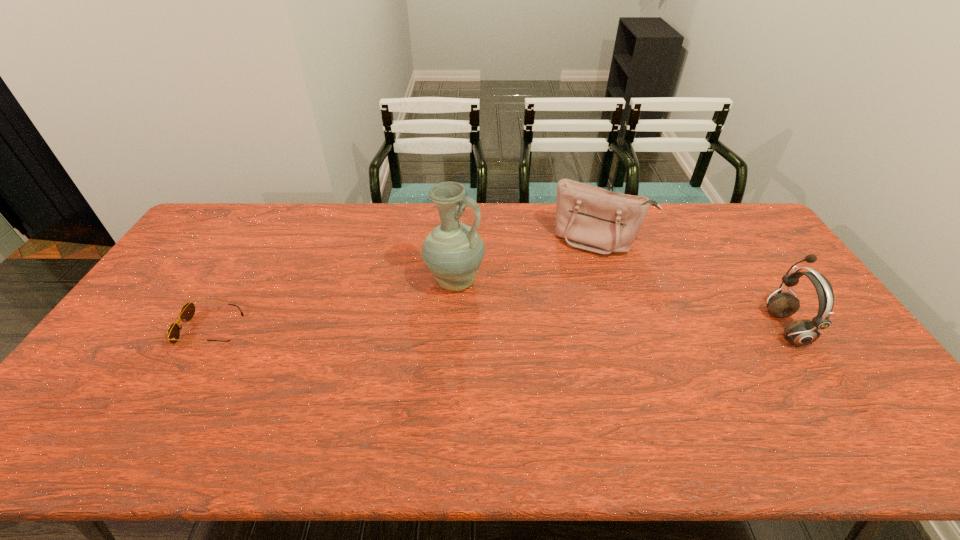
At what (x,y) coordinates should I click in order to perform the action: click on vacant space at the far edge of the desktop. Please return your answer as a coordinate pair (x, y). This screenshot has width=960, height=540. Looking at the image, I should click on (373, 219).

The width and height of the screenshot is (960, 540). What are the coordinates of `vacant space at the near edge of the desktop` in the screenshot? It's located at (669, 387).

In the image, there is a desktop. Identify the location of blank space at the right edge. Image resolution: width=960 pixels, height=540 pixels. (x=761, y=264).

Where is `free spot between the earphone and the shortest object`? free spot between the earphone and the shortest object is located at coordinates (497, 328).

Find the location of a particular element. unoccupied area between the rightmost object and the shortest object is located at coordinates (497, 328).

Locate an element on the screen. This screenshot has height=540, width=960. free space between the tallest object and the shortest object is located at coordinates (333, 306).

At what (x,y) coordinates should I click in order to perform the action: click on empty space between the earphone and the shortest object. Please return your answer as a coordinate pair (x, y). Looking at the image, I should click on (497, 328).

Identify the location of empty space that is in between the earphone and the shortest object. (497, 328).

Locate an element on the screen. free space between the sunglasses and the farthest object is located at coordinates (404, 285).

Where is `empty location between the shoulder bag and the leftmost object`? empty location between the shoulder bag and the leftmost object is located at coordinates (404, 285).